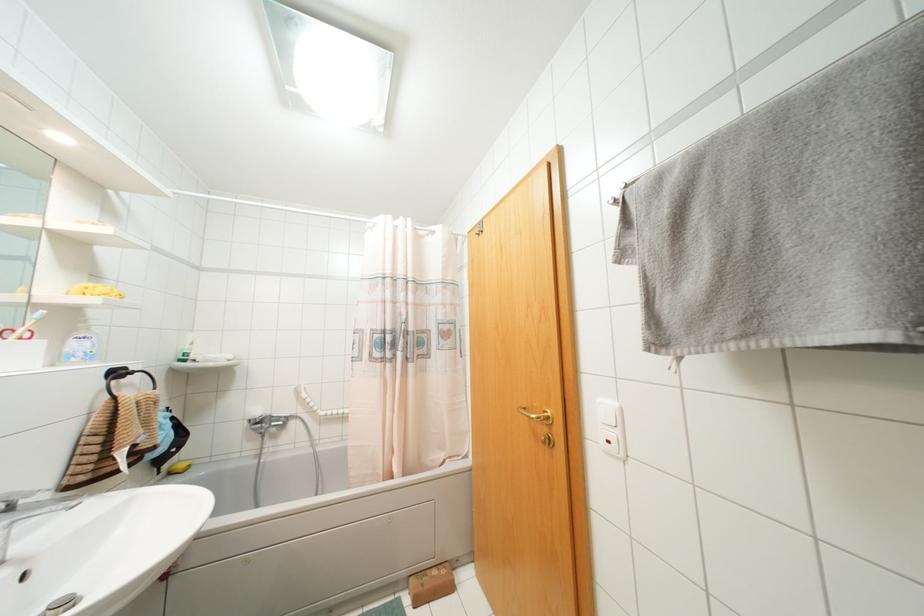
Where would you lift the green plastic bottle? Please return your answer as a coordinate pair (x, y).

(186, 351)